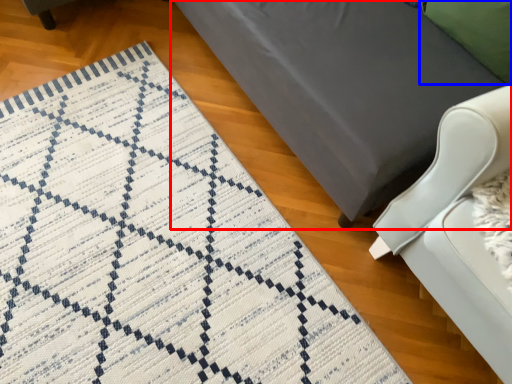
Question: Among these objects, which one is nearest to the camera, furniture (highlighted by a red box) or pillow (highlighted by a blue box)?

Choices:
 (A) furniture
 (B) pillow

Answer: (A)